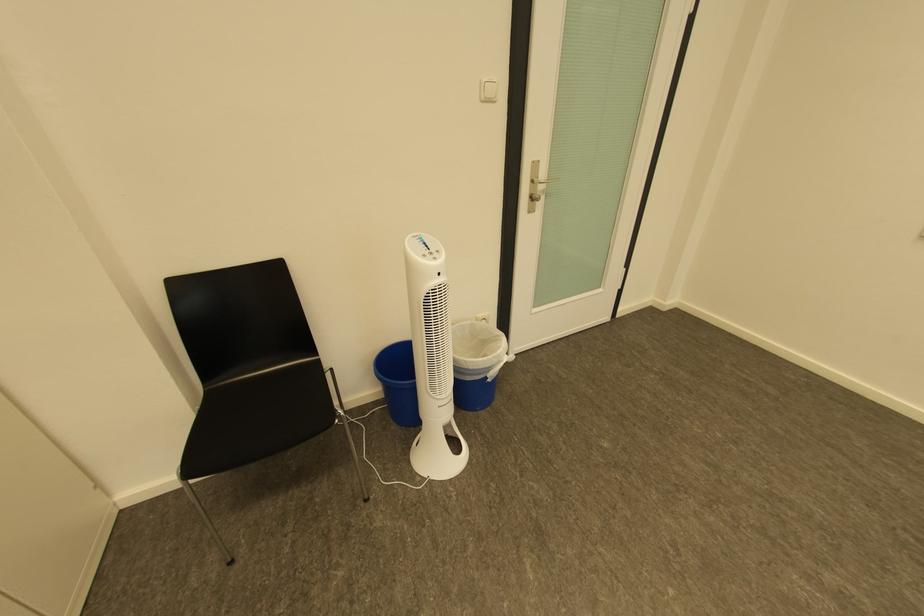
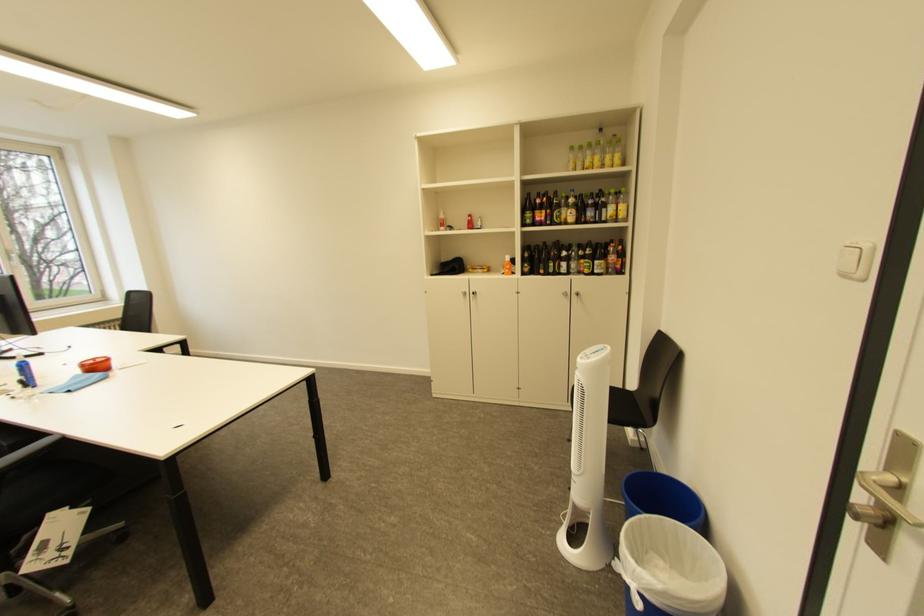
Locate, in the second image, the point that corresponds to the point at 445,259 in the first image.

(591, 359)